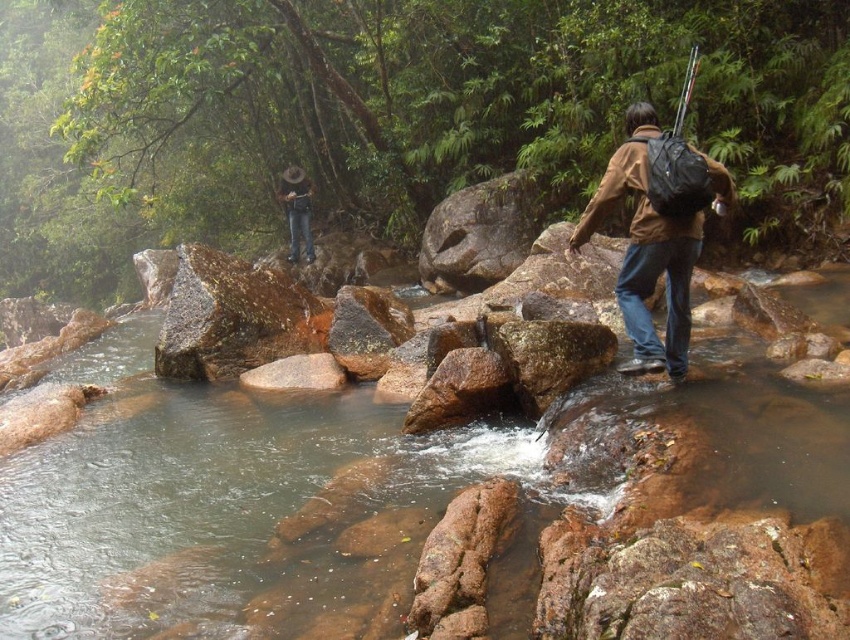
Question: Which point is closer to the camera?

Choices:
 (A) brown rock at center
 (B) brown matte jacket at center

Answer: (A)

Question: Which of the following is the farthest from the observer?

Choices:
 (A) brown rock at center
 (B) brown leather hat at upper center
 (C) brown matte jacket at center

Answer: (B)

Question: Which of the following is the farthest from the observer?

Choices:
 (A) (843, 458)
 (B) (282, 173)

Answer: (B)

Question: Considering the relative positions of brown rock at center and brown leather hat at upper center in the image provided, where is brown rock at center located with respect to brown leather hat at upper center?

Choices:
 (A) left
 (B) right

Answer: (B)

Question: Is brown rock at center positioned before brown leather hat at upper center?

Choices:
 (A) no
 (B) yes

Answer: (B)

Question: Is brown matte jacket at center wider than brown leather hat at upper center?

Choices:
 (A) yes
 (B) no

Answer: (B)